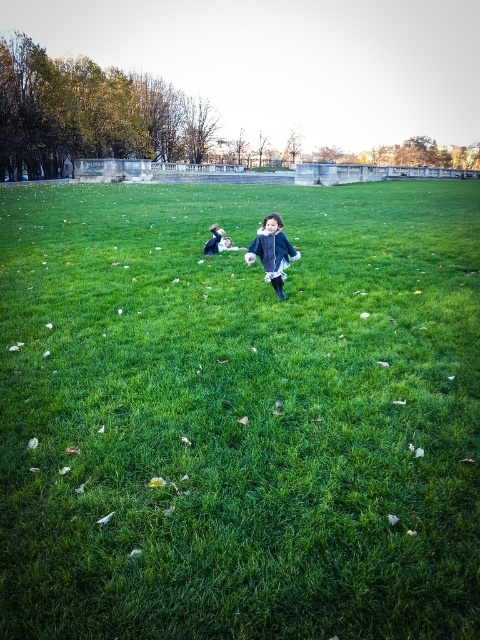
You are standing in the park and see the green grass at center and the matte black jacket at center. Which object is located to the right of the other?

The green grass at center is to the right of the matte black jacket at center.

You are standing in the park and see the green grass at center and the matte blue coat at center. Which object is positioned more to the left side?

The green grass at center is positioned more to the left side than the matte blue coat at center.